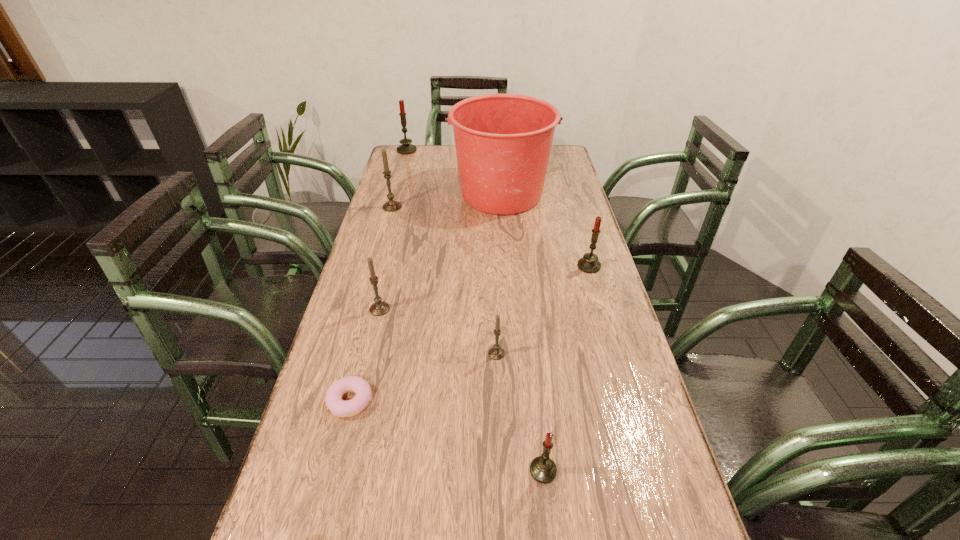
Identify the location of pink bucket. (503, 142).

At what (x,y) coordinates should I click in order to perform the action: click on bucket. Please return your answer as a coordinate pair (x, y). The image size is (960, 540). Looking at the image, I should click on (503, 142).

Where is `the biggest red candle`? the biggest red candle is located at coordinates (x=405, y=148).

You are a GUI agent. You are given a task and a screenshot of the screen. Output one action in this format:
    pyautogui.click(x=<x>, y=<y>)
    Task: Click on the farthest red candle
    
    Given the screenshot: What is the action you would take?
    pyautogui.click(x=405, y=148)

This screenshot has height=540, width=960. Identify the location of the biggest gray candle. (390, 206).

The image size is (960, 540). I want to click on the farthest gray candle, so click(390, 206).

You are a GUI agent. You are given a task and a screenshot of the screen. Output one action in this format:
    pyautogui.click(x=<x>, y=<y>)
    Task: Click on the second biggest red candle
    
    Given the screenshot: What is the action you would take?
    pyautogui.click(x=589, y=263)

Find the location of a particular element. Image resolution: width=960 pixels, height=540 pixels. the rightmost candle is located at coordinates (589, 263).

Locate an element on the screen. This screenshot has height=540, width=960. the third nearest candle is located at coordinates (379, 308).

You are a GUI agent. You are given a task and a screenshot of the screen. Output one action in this format:
    pyautogui.click(x=<x>, y=<y>)
    Task: Click on the second biggest gray candle
    
    Given the screenshot: What is the action you would take?
    pyautogui.click(x=379, y=308)